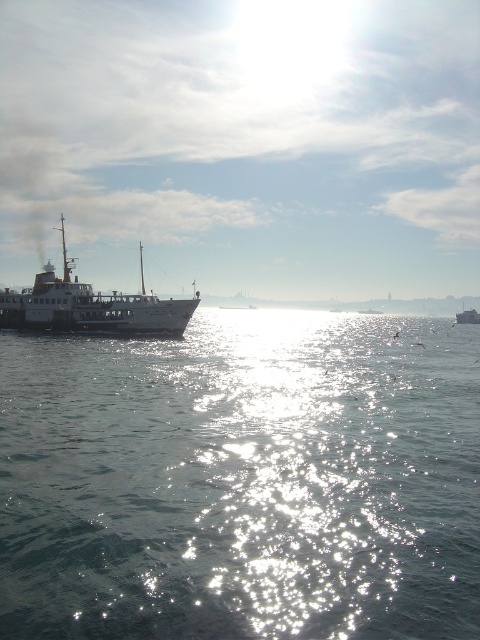
You are standing on the deck of the ferry and looking towards the water. There are two points marked on the water surface. Which point, point (343, 552) or point (98, 324), is closer to you?

Point (343, 552) is closer to you because it is in front of point (98, 324).

You are a sailor observing two metallic gray ferry ships in the water. Which ferry is closer to you, the metallic gray ferry at left or the metallic gray ferry at right?

The metallic gray ferry at left is smaller than the metallic gray ferry at right, so the metallic gray ferry at left is closer to you.